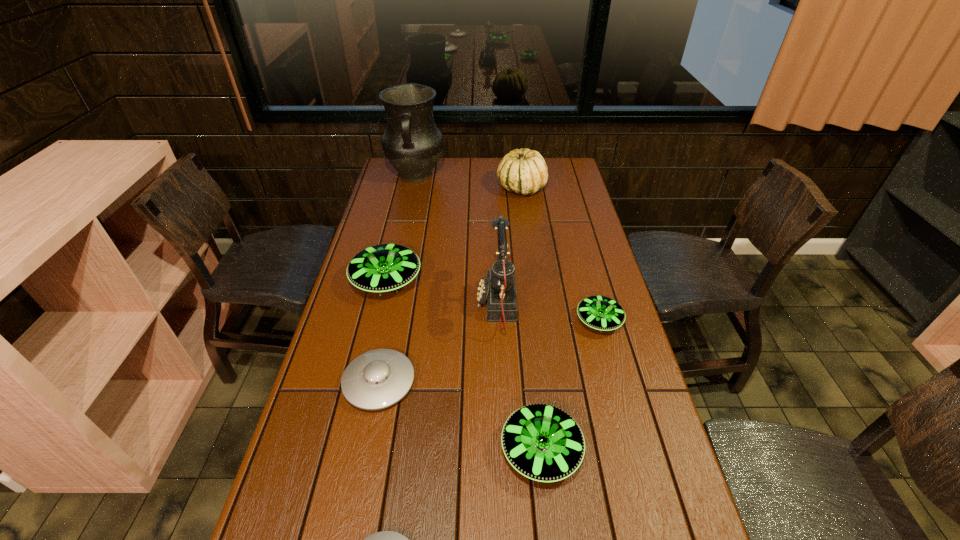
This screenshot has width=960, height=540. In order to click on vacant region located on the back of the fourth saucer from left to right in this screenshot , I will do `click(525, 297)`.

I want to click on free space located on the left of the rightmost saucer, so click(x=462, y=321).

Identify the location of vacant space located 0.230m on the right of the farther gray saucer. The width and height of the screenshot is (960, 540). (505, 382).

Find the location of a particular element. pitcher positioned at the far edge is located at coordinates (412, 143).

Locate an element on the screen. Image resolution: width=960 pixels, height=540 pixels. gourd present at the far edge is located at coordinates (524, 171).

Where is `pitcher at the left edge`? The image size is (960, 540). pitcher at the left edge is located at coordinates (412, 143).

Identify the location of gourd that is at the right edge. The width and height of the screenshot is (960, 540). (524, 171).

This screenshot has width=960, height=540. Find the location of `saucer that is at the right edge`. saucer that is at the right edge is located at coordinates (602, 313).

Find the location of a particular element. Image resolution: width=960 pixels, height=540 pixels. object at the far left corner is located at coordinates (412, 143).

You are a GUI agent. You are given a task and a screenshot of the screen. Output one action in this format:
    pyautogui.click(x=<x>, y=<y>)
    Task: Click on the object that is positioned at the far right corner
    The height and width of the screenshot is (540, 960).
    Given the screenshot: What is the action you would take?
    click(x=524, y=171)